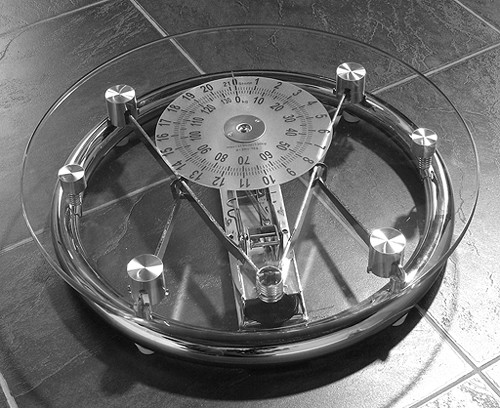
Locate an element on the screen. The width and height of the screenshot is (500, 408). floor tiles is located at coordinates (397, 366), (486, 285), (464, 113), (38, 80).